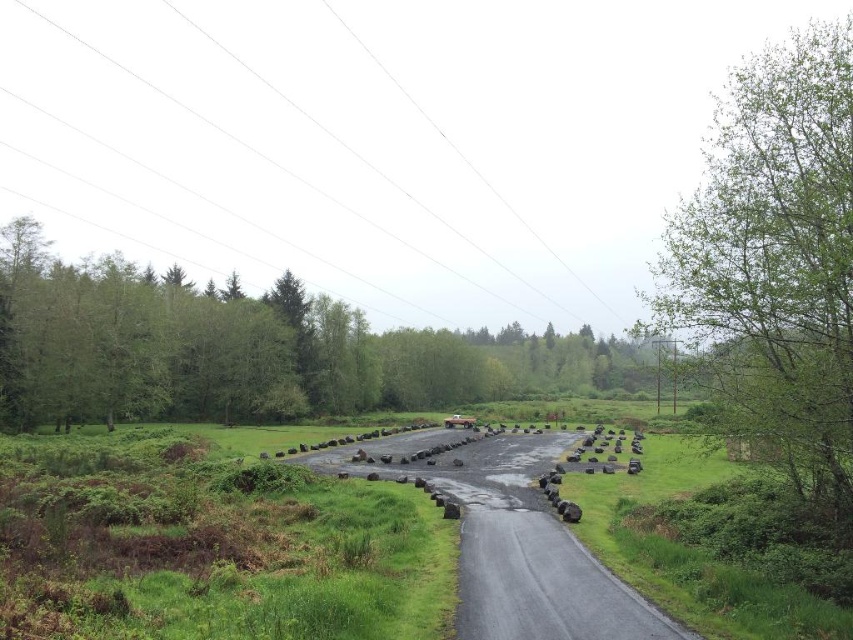
Can you confirm if green leafy tree at left is positioned above green leafy tree at right?

No.

Can you confirm if green leafy tree at left is positioned to the right of green leafy tree at right?

Incorrect, green leafy tree at left is not on the right side of green leafy tree at right.

Who is more forward, (334, 406) or (807, 380)?

Positioned in front is point (807, 380).

Locate an element on the screen. This screenshot has width=853, height=640. green leafy tree at left is located at coordinates (244, 349).